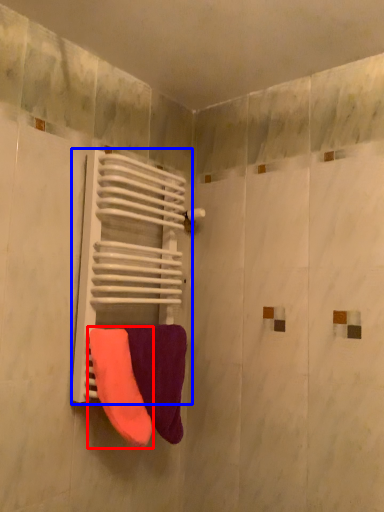
Question: Which point is further to the camera, towel (highlighted by a red box) or radiator (highlighted by a blue box)?

Choices:
 (A) towel
 (B) radiator

Answer: (B)